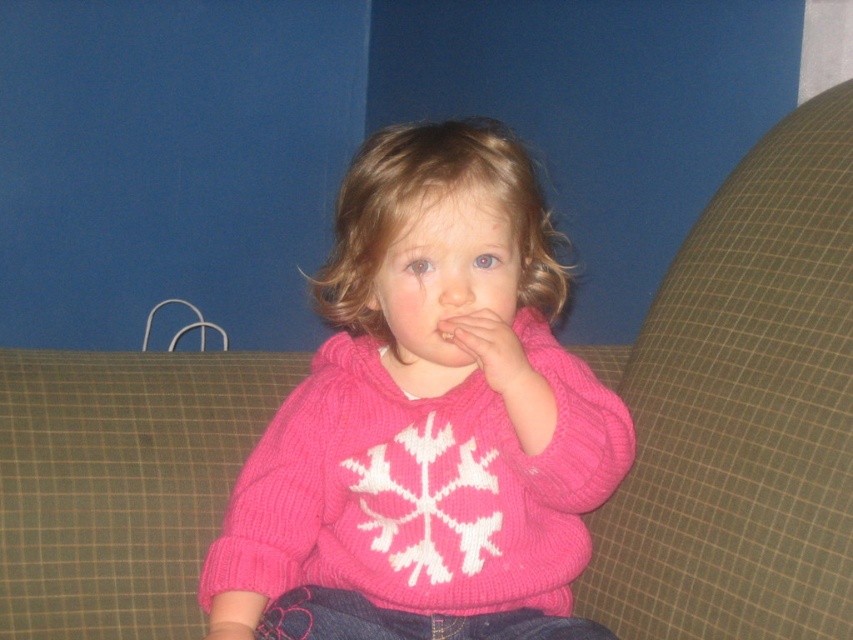
What are the exact coordinates of the pink knitted sweater at center in the image?

The pink knitted sweater at center is located at point (424,422).

You are trying to locate two points in the image. The first point is at coordinates point[416,378] and the second is at point[447,340]. Based on their positions, which point is closer to the viewer?

Point[447,340] is closer to the viewer because it is in front of point[416,378].